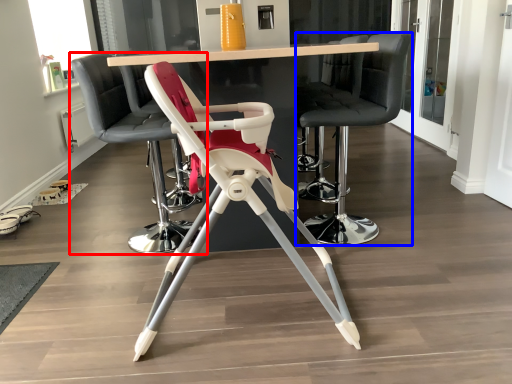
Question: Among these objects, which one is nearest to the camera, chair (highlighted by a red box) or chair (highlighted by a blue box)?

Choices:
 (A) chair
 (B) chair

Answer: (B)